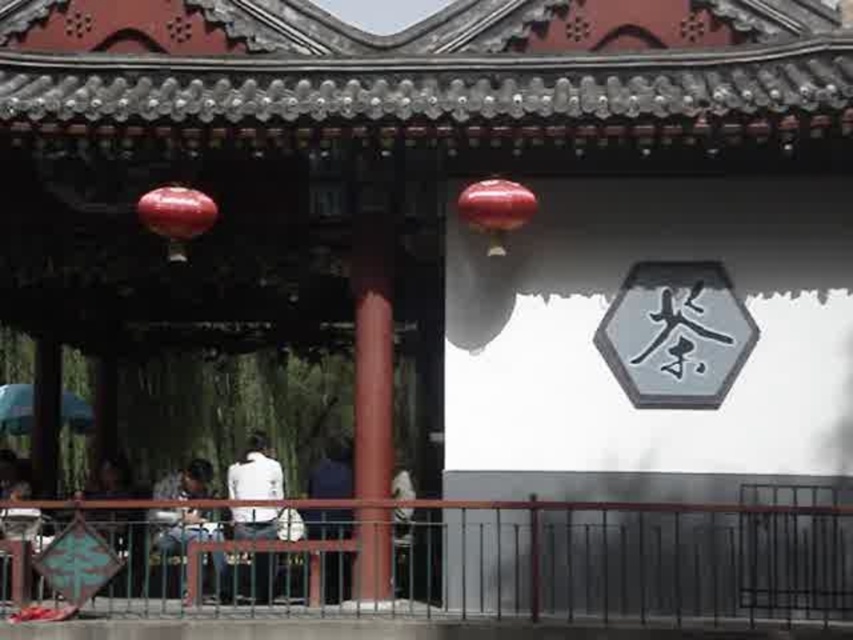
Question: Which of the following is the closest to the observer?

Choices:
 (A) (167, 243)
 (B) (369, 480)

Answer: (B)

Question: Does dark blue jeans at lower center have a greater width compared to glossy red paper lantern at upper left?

Choices:
 (A) yes
 (B) no

Answer: (A)

Question: Which object appears closest to the camera in this image?

Choices:
 (A) white matte shirt at center
 (B) smooth red pillar at center

Answer: (B)

Question: Can you confirm if smooth red pillar at center is positioned to the right of white matte shirt at center?

Choices:
 (A) no
 (B) yes

Answer: (B)

Question: Does white matte shirt at center have a lesser width compared to glossy red paper lantern at upper left?

Choices:
 (A) yes
 (B) no

Answer: (A)

Question: Which of these objects is positioned farthest from the smooth red pillar at center?

Choices:
 (A) dark blue jeans at lower center
 (B) glossy red paper lantern at center
 (C) dark blue shirt at center
 (D) glossy red paper lantern at upper left

Answer: (A)